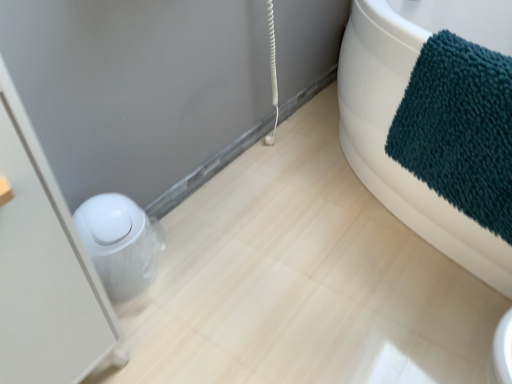
Question: Is white glossy toilet bowl at lower left spatially inside teal plush towel at upper right, or outside of it?

Choices:
 (A) outside
 (B) inside

Answer: (A)

Question: Based on their positions, is white glossy toilet bowl at lower left located to the left or right of teal plush towel at upper right?

Choices:
 (A) right
 (B) left

Answer: (B)

Question: Considering the real-world distances, which object is farthest from the white glossy toilet bowl at lower left?

Choices:
 (A) white glossy trash can at left
 (B) teal plush towel at upper right

Answer: (B)

Question: Which object is the closest to the white glossy trash can at left?

Choices:
 (A) teal plush towel at upper right
 (B) white glossy toilet bowl at lower left

Answer: (B)